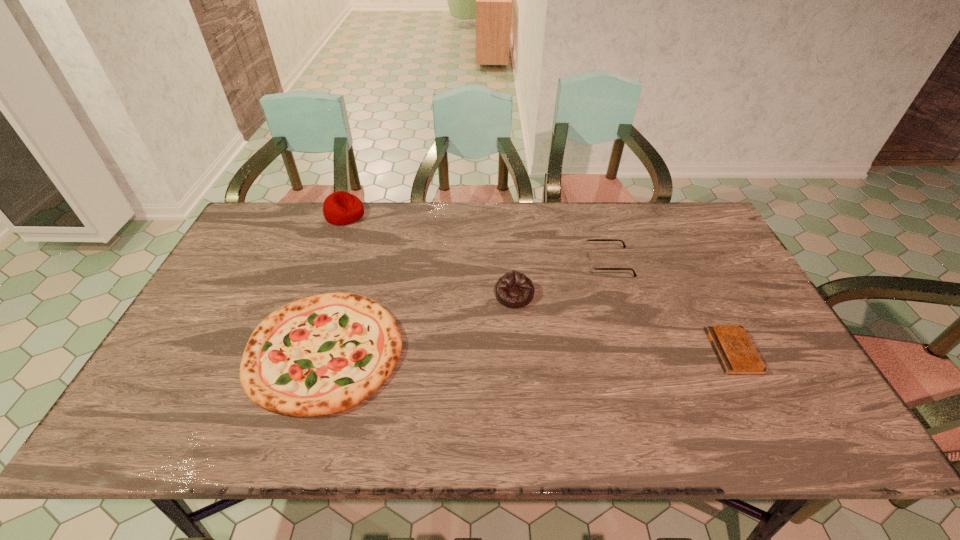
Locate an element on the screen. The image size is (960, 540). empty location between the farther beanbag and the pizza is located at coordinates (335, 282).

Identify the location of vacant point located between the pizza and the rightmost object. This screenshot has height=540, width=960. (529, 351).

At what (x,y) coordinates should I click in order to perform the action: click on free area in between the third object from left to right and the rightmost object. Please return your answer as a coordinate pair (x, y). The height and width of the screenshot is (540, 960). Looking at the image, I should click on (624, 323).

Where is `vacant space that's between the farthest object and the pizza`? This screenshot has height=540, width=960. vacant space that's between the farthest object and the pizza is located at coordinates (335, 282).

You are a GUI agent. You are given a task and a screenshot of the screen. Output one action in this format:
    pyautogui.click(x=<x>, y=<y>)
    Task: Click on the vacant space that's between the shortest object and the second farthest object
    
    Given the screenshot: What is the action you would take?
    pyautogui.click(x=670, y=307)

The image size is (960, 540). In order to click on free space between the second farthest object and the nearer beanbag in this screenshot , I will do `click(562, 279)`.

In order to click on free spot between the pizza and the shorter beanbag in this screenshot , I will do `click(420, 323)`.

Find the location of a particular element. The width and height of the screenshot is (960, 540). object that stands as the closest to the pizza is located at coordinates (514, 289).

Where is `object that ranks as the fourth closest to the farthest object`? The height and width of the screenshot is (540, 960). object that ranks as the fourth closest to the farthest object is located at coordinates (737, 355).

Identify the location of vacant space that satisfies the following two spatial constraints: 1. on the seat area of the farthest object; 2. on the right side of the shorter beanbag. The height and width of the screenshot is (540, 960). (315, 295).